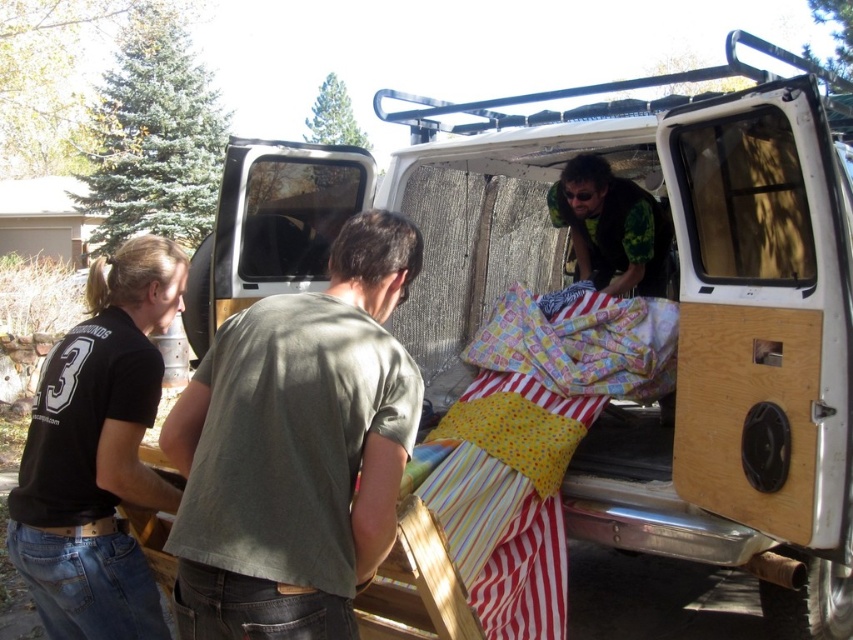
Does green cotton shirt at center have a larger size compared to black cotton shirt at left?

Correct, green cotton shirt at center is larger in size than black cotton shirt at left.

Locate an element on the screen. This screenshot has width=853, height=640. green cotton shirt at center is located at coordinates (296, 449).

I want to click on green cotton shirt at center, so click(296, 449).

Image resolution: width=853 pixels, height=640 pixels. In order to click on green cotton shirt at center in this screenshot , I will do `click(296, 449)`.

Does green cotton shirt at center have a larger size compared to green camouflage shirt at center?

No, green cotton shirt at center is not bigger than green camouflage shirt at center.

Based on the photo, who is positioned more to the left, green cotton shirt at center or green camouflage shirt at center?

From the viewer's perspective, green cotton shirt at center appears more on the left side.

Does point (196, 426) come behind point (635, 282)?

No, (196, 426) is closer to viewer.

Locate an element on the screen. The height and width of the screenshot is (640, 853). green cotton shirt at center is located at coordinates (296, 449).

Does white wood van at center have a lesser height compared to green camouflage shirt at center?

In fact, white wood van at center may be taller than green camouflage shirt at center.

Who is higher up, white wood van at center or green camouflage shirt at center?

Positioned higher is green camouflage shirt at center.

Image resolution: width=853 pixels, height=640 pixels. What do you see at coordinates (666, 289) in the screenshot? I see `white wood van at center` at bounding box center [666, 289].

At what (x,y) coordinates should I click in order to perform the action: click on white wood van at center. Please return your answer as a coordinate pair (x, y). Looking at the image, I should click on (666, 289).